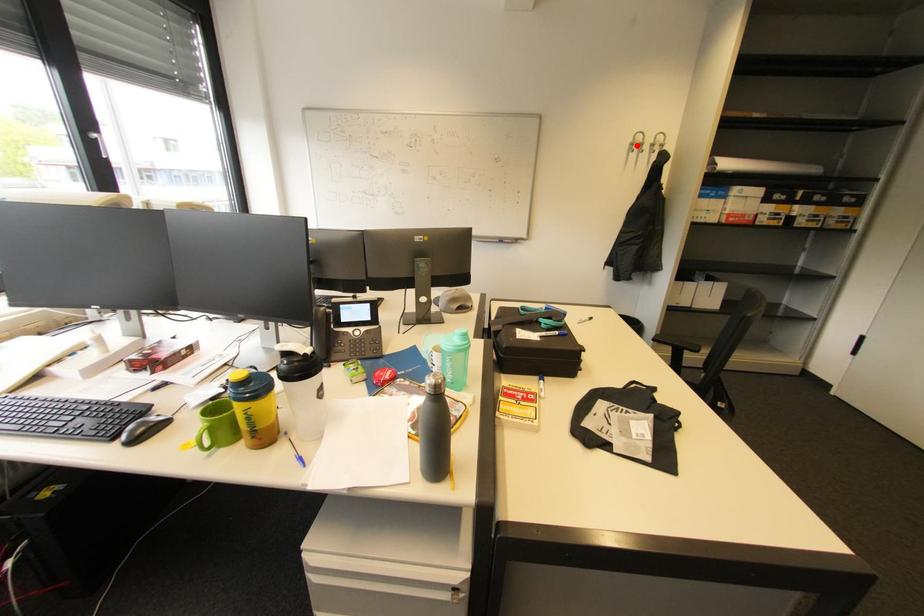
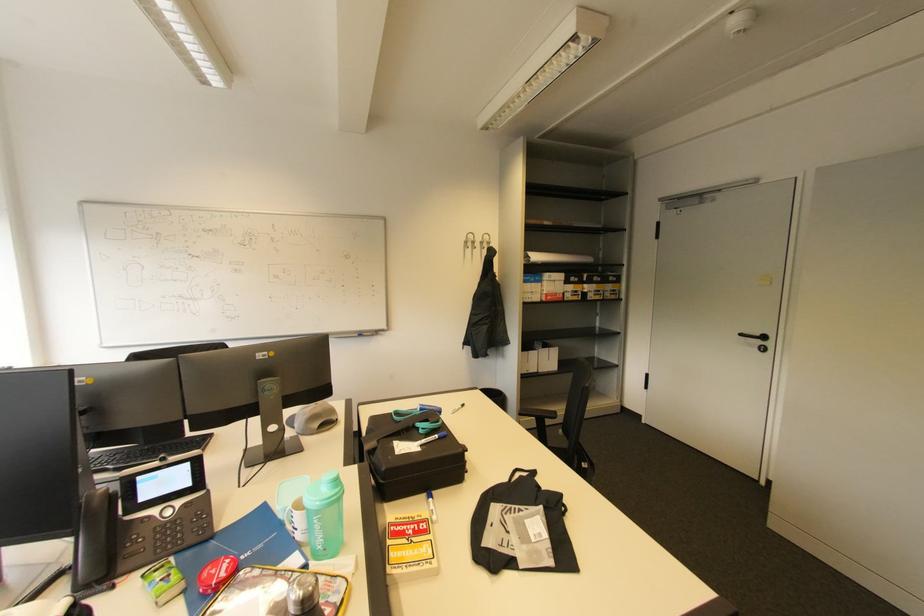
Find the pixel in the second image that matches the highlighted location in the first image.

(470, 243)